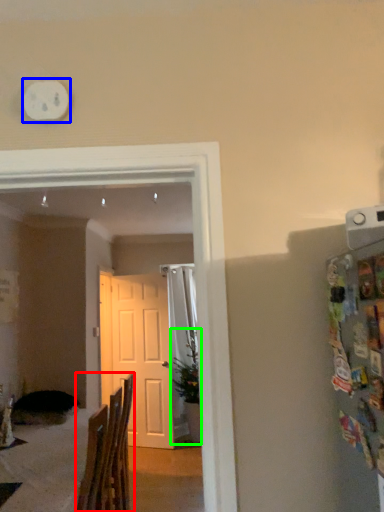
Question: Estimate the real-world distances between objects in this image. Which object is farther from chair (highlighted by a red box), clock (highlighted by a blue box) or houseplant (highlighted by a green box)?

Choices:
 (A) clock
 (B) houseplant

Answer: (B)